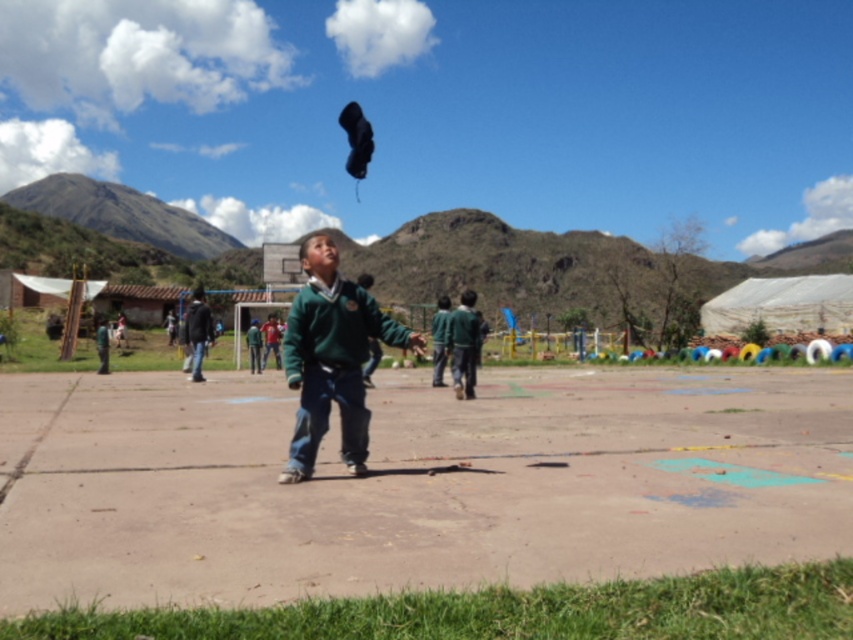
Who is shorter, green matte sweater at center or green matte uniform at center?

With less height is green matte uniform at center.

Which is in front, point (331, 257) or point (450, 342)?

Point (331, 257) is in front.

This screenshot has width=853, height=640. In order to click on green matte sweater at center in this screenshot , I will do `click(331, 356)`.

In the scene shown: Is green matte sweater at center below dark gray hoodie at left?

Yes.

Who is more forward, (326,420) or (190,330)?

Positioned in front is point (326,420).

Locate an element on the screen. This screenshot has width=853, height=640. green matte sweater at center is located at coordinates (331, 356).

Does green matte uniform at center appear on the right side of dark gray hoodie at left?

Yes, green matte uniform at center is to the right of dark gray hoodie at left.

Which is behind, point (461, 349) or point (189, 321)?

The point (189, 321) is behind.

Locate an element on the screen. green matte uniform at center is located at coordinates (463, 344).